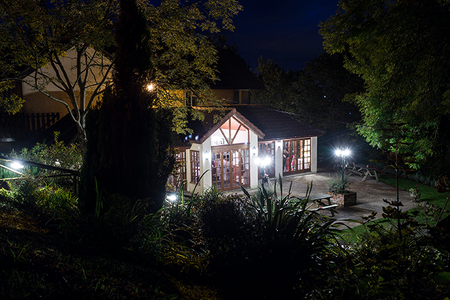
This screenshot has height=300, width=450. In order to click on the first floor in this screenshot , I will do `click(231, 135)`.